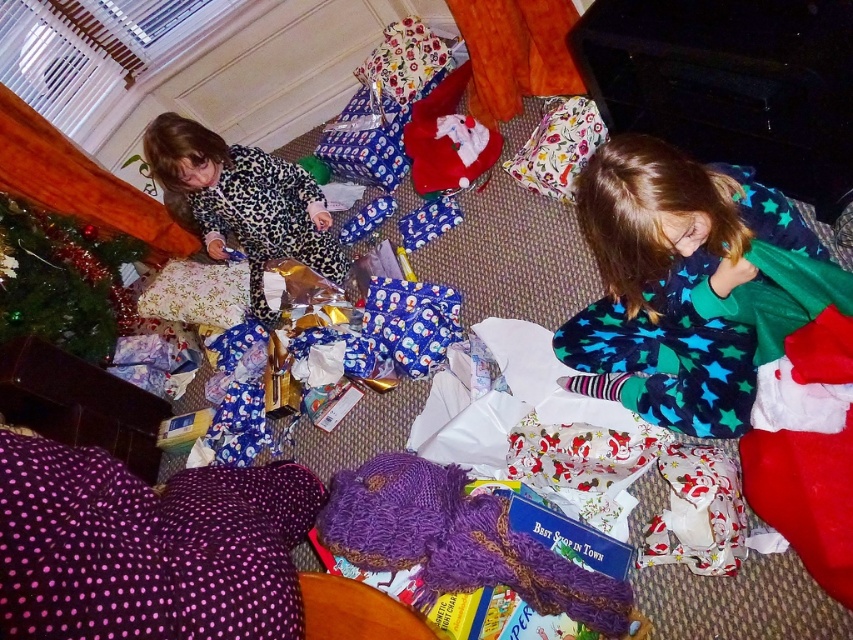
Is purple polka dot blanket at lower left behind leopard print pajamas at left?

That is False.

This screenshot has width=853, height=640. In order to click on purple polka dot blanket at lower left in this screenshot , I will do `click(148, 547)`.

Does point (122, 636) come behind point (247, 189)?

No.

Where is `purple polka dot blanket at lower left`? The image size is (853, 640). purple polka dot blanket at lower left is located at coordinates (148, 547).

Is point (166, 141) closer to camera compared to point (131, 314)?

Yes, point (166, 141) is closer to viewer.

Is leopard print pajamas at left taller than green artificial at left?

Yes.

What do you see at coordinates (244, 202) in the screenshot?
I see `leopard print pajamas at left` at bounding box center [244, 202].

Identify the location of leopard print pajamas at left. (244, 202).

Who is positioned more to the right, blue star-patterned pajamas at lower right or green artificial at left?

blue star-patterned pajamas at lower right is more to the right.

Is blue star-patterned pajamas at lower right smaller than green artificial at left?

Actually, blue star-patterned pajamas at lower right might be larger than green artificial at left.

Measure the distance between point (744, 168) and camera.

Point (744, 168) and camera are 4.72 feet apart from each other.

Locate an element on the screen. The image size is (853, 640). blue star-patterned pajamas at lower right is located at coordinates click(672, 284).